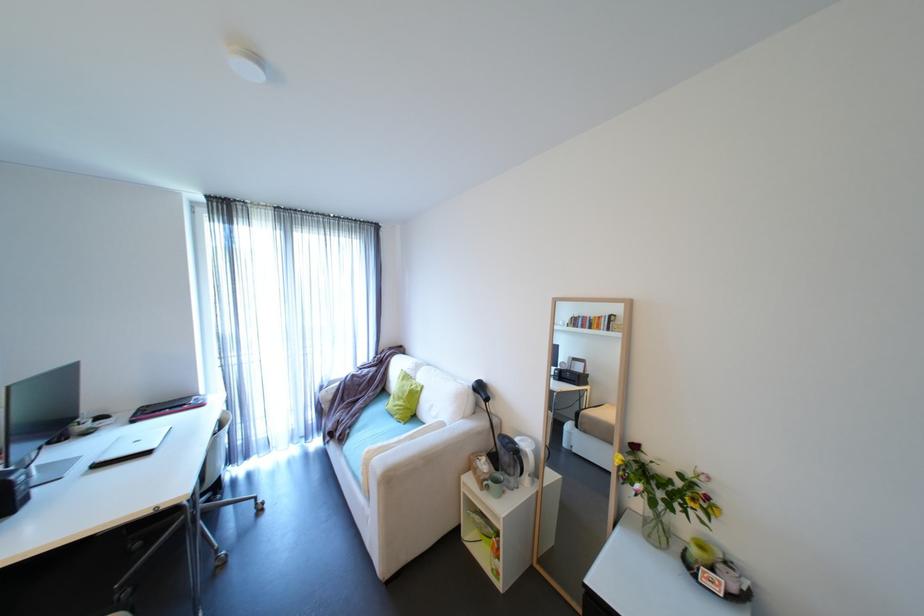
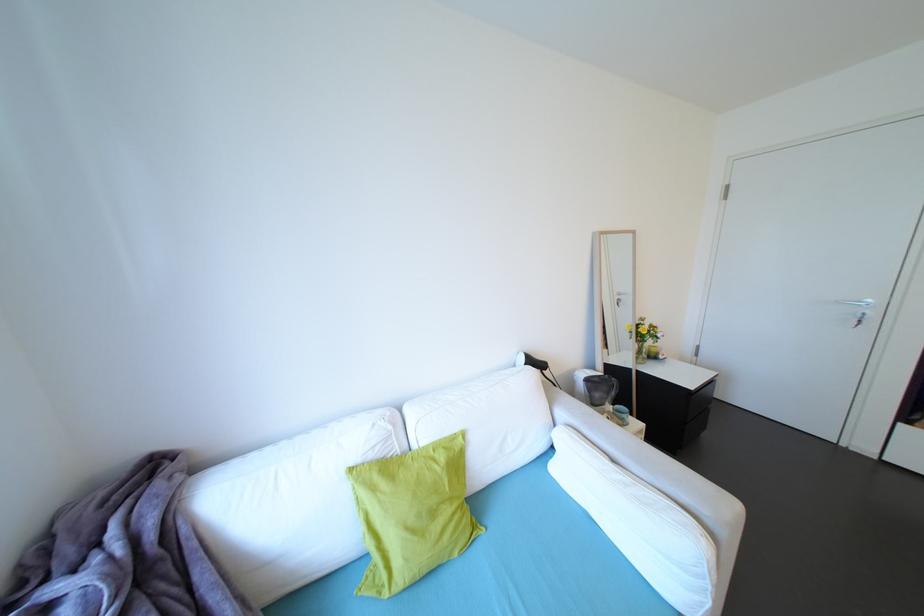
Locate, in the second image, the point that corresponds to [423,386] in the first image.

(451, 448)